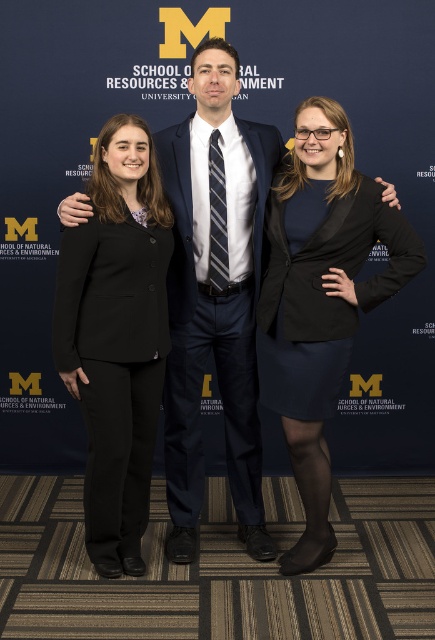
You are a photographer setting up for a group photo. You need to ensure that the matte black blazer at center and the navy blue fabric business suit at center are at least 12 inches apart for better visibility. Based on the current setup, is this requirement met?

The matte black blazer at center and navy blue fabric business suit at center are 11.21 inches apart, which is less than the required 12 inches. Therefore, the requirement is not met.

In the scene shown: You are attending a university event and see two people dressed in black suits. One is wearing a matte black suit at center and the other a black wool business suit at left. Based on their positions relative to the backdrop, which suit is closer to the School of Natural Resources logo?

The matte black suit at center is closer to the School of Natural Resources logo because it is positioned over the black wool business suit at left, indicating it is in front.

You are a photographer at the event and want to ensure that the matte black blazer at center and the navy blue fabric business suit at center are both clearly visible in the photo. Based on their positions, which one might need to be moved slightly forward to ensure both are visible?

The navy blue fabric business suit at center is currently behind the matte black blazer at center, so moving it slightly forward would help ensure both are visible.